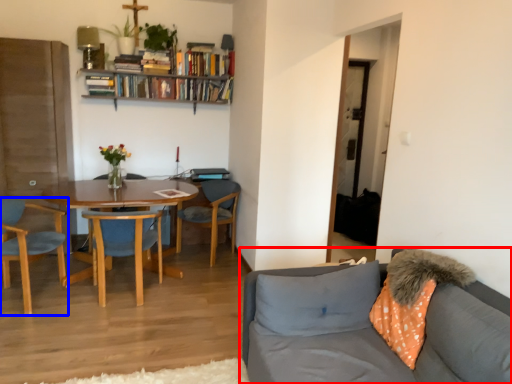
Question: Which point is further to the camera, studio couch (highlighted by a red box) or chair (highlighted by a blue box)?

Choices:
 (A) studio couch
 (B) chair

Answer: (B)